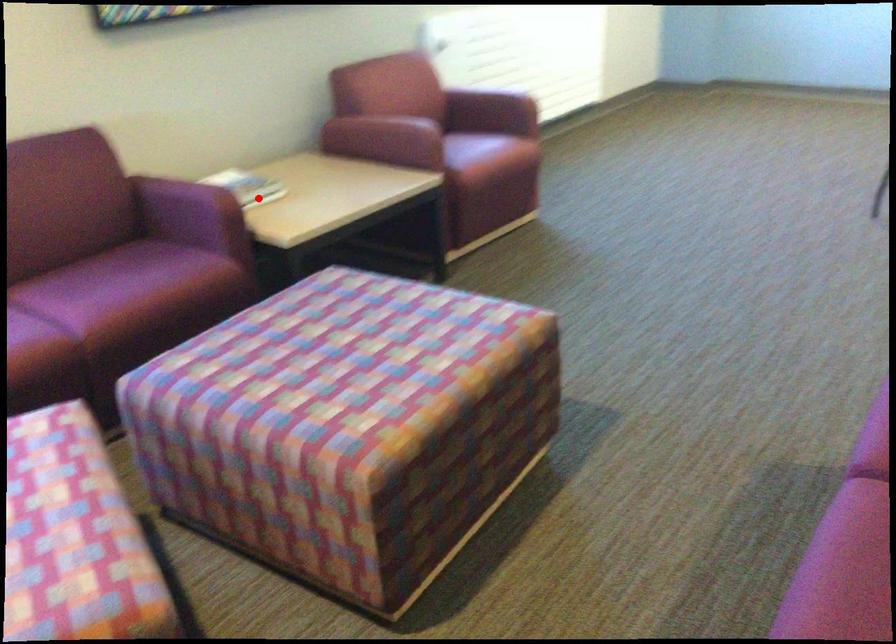
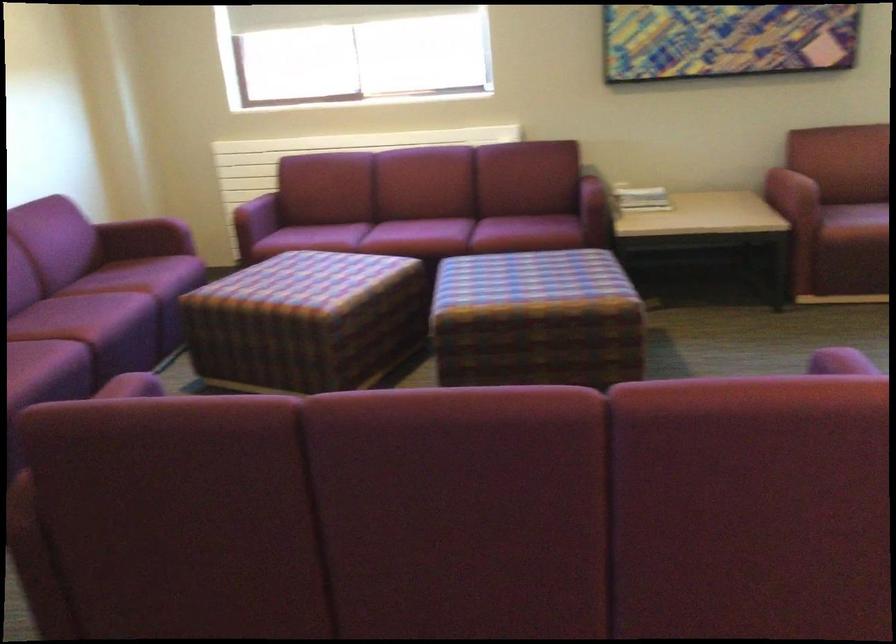
The point at the highlighted location is marked in the first image. Where is the corresponding point in the second image?

(640, 198)